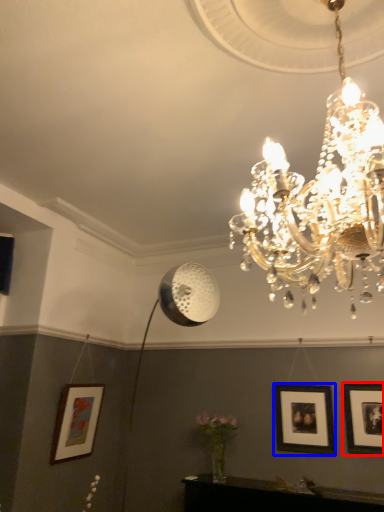
Question: Which object appears closest to the camera in this image, picture frame (highlighted by a red box) or picture frame (highlighted by a blue box)?

Choices:
 (A) picture frame
 (B) picture frame

Answer: (A)